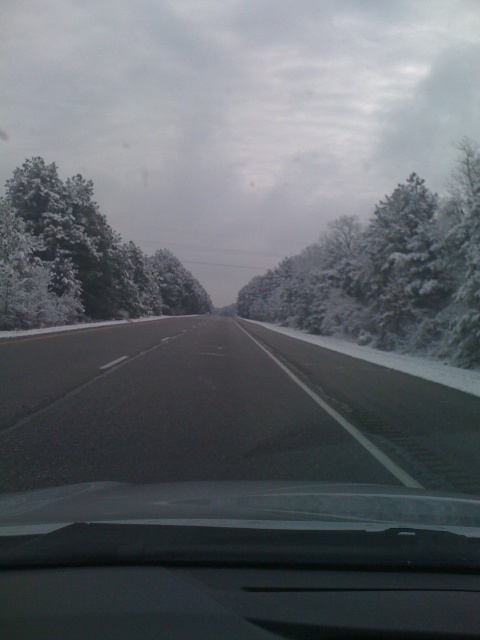
You are driving on a winter road and notice the black asphalt highway at center. If you want to stay within the road, which direction should you steer your vehicle relative to the highway?

The black asphalt highway at center is located at point coordinates, so you should keep your vehicle centered on the road to stay within the lanes marked by the white dashed lines and edge line.